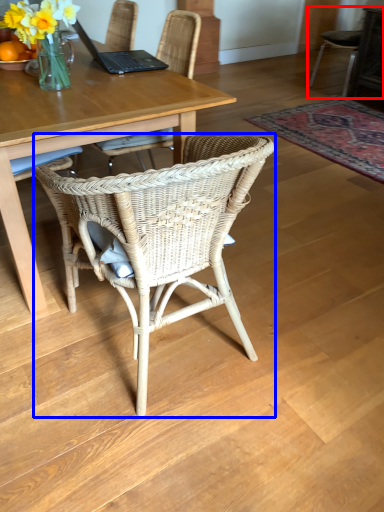
Question: Which of the following is the closest to the observer, chair (highlighted by a red box) or chair (highlighted by a blue box)?

Choices:
 (A) chair
 (B) chair

Answer: (B)